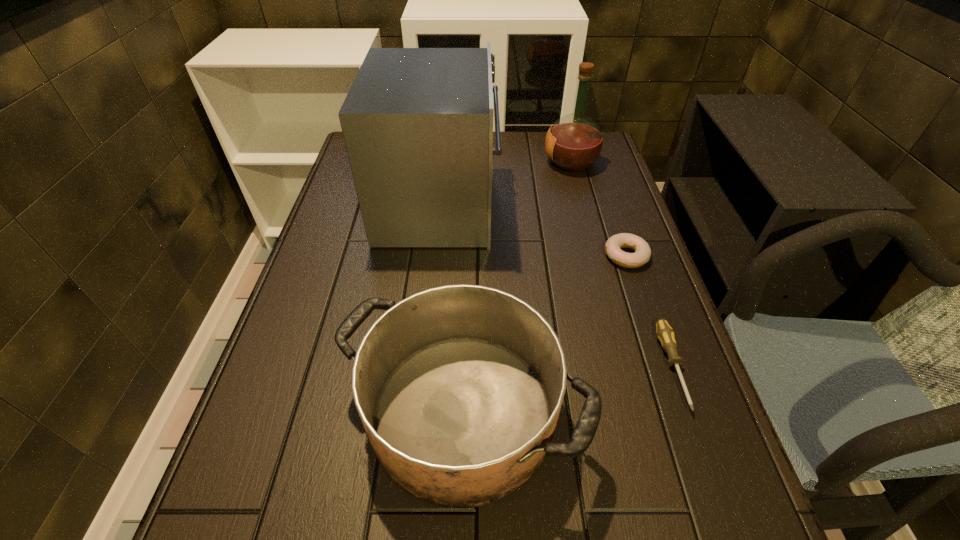
Locate an element on the screen. The height and width of the screenshot is (540, 960). blank space at the left edge of the desktop is located at coordinates (287, 334).

Find the location of `free space at the right edge of the desktop`. free space at the right edge of the desktop is located at coordinates tap(583, 257).

What are the coordinates of `vacant space that is in between the tallest object and the doughnut` in the screenshot? It's located at (533, 231).

Find the location of a particular element. This screenshot has height=540, width=960. vacant region between the fourth shortest object and the doughnut is located at coordinates click(x=598, y=209).

This screenshot has height=540, width=960. I want to click on vacant space that's between the saucepan and the screwdriver, so click(x=567, y=389).

You are a GUI agent. You are given a task and a screenshot of the screen. Output one action in this format:
    pyautogui.click(x=<x>, y=<y>)
    Task: Click on the unoccupied position between the doughnut and the liquor
    
    Given the screenshot: What is the action you would take?
    pyautogui.click(x=598, y=209)

Locate an element on the screen. The image size is (960, 540). empty space between the screwdriver and the doughnut is located at coordinates (649, 312).

At what (x,y) coordinates should I click in order to perform the action: click on vacant space that's between the tallest object and the fourth shortest object. Please return your answer as a coordinate pair (x, y). The height and width of the screenshot is (540, 960). Looking at the image, I should click on (505, 184).

At what (x,y) coordinates should I click in order to perform the action: click on free space between the tallest object and the doughnut. Please return your answer as a coordinate pair (x, y). Looking at the image, I should click on (533, 231).

Locate an element on the screen. This screenshot has height=540, width=960. free space between the tallest object and the doughnut is located at coordinates (533, 231).